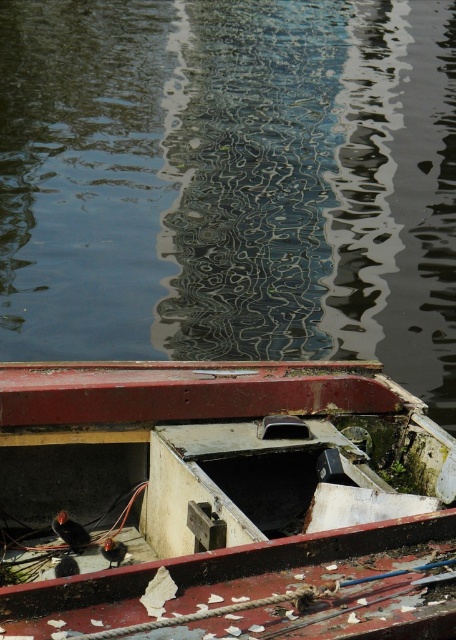
Is smooth water at center further to the viewer compared to rusty metal boat at lower center?

Yes, smooth water at center is behind rusty metal boat at lower center.

Does smooth water at center appear on the left side of rusty metal boat at lower center?

Indeed, smooth water at center is positioned on the left side of rusty metal boat at lower center.

Who is more distant from viewer, (x=232, y=186) or (x=198, y=612)?

Positioned behind is point (x=232, y=186).

Find the location of a particular element. The height and width of the screenshot is (640, 456). smooth water at center is located at coordinates (231, 182).